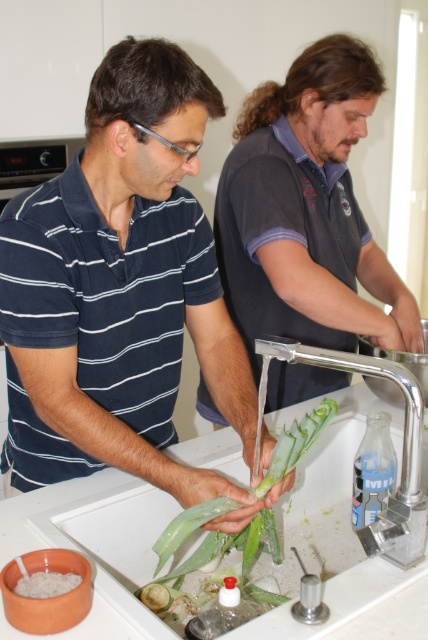
Question: Is blue striped shirt at left bigger than white ceramic sink at lower center?

Choices:
 (A) yes
 (B) no

Answer: (B)

Question: Does blue striped shirt at left have a greater width compared to green leafy vegetable at center?

Choices:
 (A) yes
 (B) no

Answer: (A)

Question: Does blue striped shirt at left have a smaller size compared to dark gray shirt at upper center?

Choices:
 (A) yes
 (B) no

Answer: (A)

Question: Based on their relative distances, which object is nearer to the transparent plastic aloe vera at lower right?

Choices:
 (A) blue striped shirt at left
 (B) dark gray shirt at upper center
 (C) green leafy vegetable at center
 (D) chrome metallic faucet at upper right

Answer: (D)

Question: Which object appears farthest from the camera in this image?

Choices:
 (A) white ceramic sink at lower center
 (B) transparent plastic aloe vera at lower right

Answer: (B)

Question: Which point appears farthest from the camera in this image?

Choices:
 (A) (154, 572)
 (B) (148, 541)

Answer: (B)